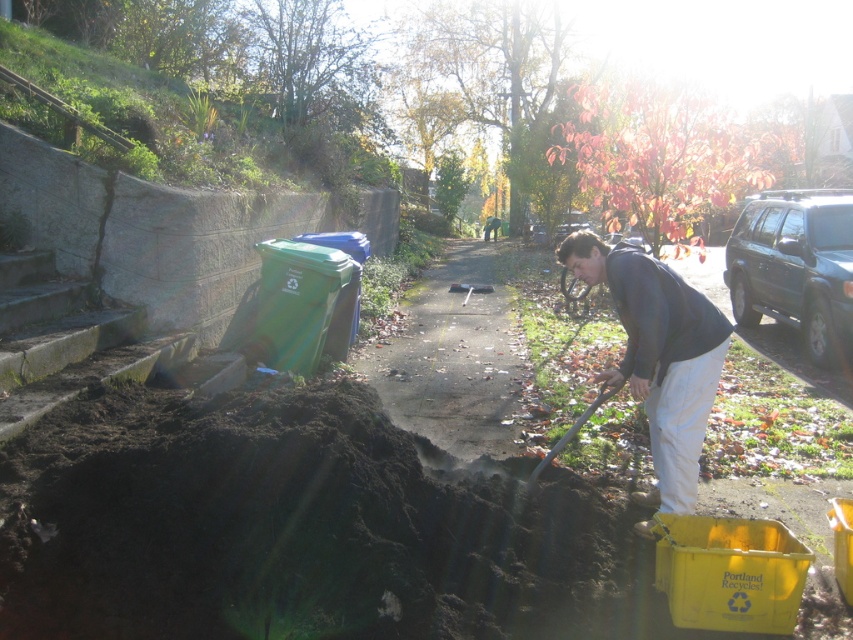
You are standing at the point marked by the coordinates [659,356] in the image. What object are you directly facing?

The point marked by the coordinates [659,356] indicates the dark gray hoodie at center, so you are directly facing the dark gray hoodie at center.

You are a delivery person trying to locate the homeowner who is wearing a dark gray hoodie at center. Based on the scene description, where would you look to find the homeowner?

The homeowner wearing the dark gray hoodie at center is located at the point with coordinates 0.558 on the x axis and 0.773 on the y axis.

You are a delivery person approaching the pathway and see the dark gray hoodie at center and the wooden shovel at lower center. Which object is closer to the right side of the pathway?

The dark gray hoodie at center is closer to the right side of the pathway because it is positioned to the right of the wooden shovel at lower center.